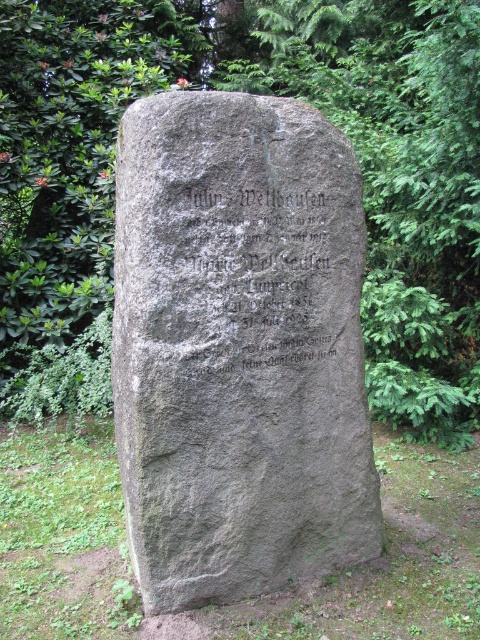
Identify the location of gray stone gravestone at center. (239, 348).

Who is more distant from viewer, (x=204, y=339) or (x=194, y=340)?

The point (x=204, y=339) is behind.

Which is in front, point (157, 387) or point (227, 323)?

Point (157, 387) is in front.

Identify the location of gray stone gravestone at center. (239, 348).

Does point (176, 36) come farther from viewer compared to point (121, 381)?

Yes, it is behind point (121, 381).

In the scene shown: Between green leafy tree at upper center and gray stone gravestone at center, which one appears on the right side from the viewer's perspective?

gray stone gravestone at center

Locate an element on the screen. Image resolution: width=480 pixels, height=640 pixels. green leafy tree at upper center is located at coordinates (252, 92).

Find the location of a particular element. The width and height of the screenshot is (480, 640). green leafy tree at upper center is located at coordinates (252, 92).

Who is more distant from viewer, (444, 216) or (284, 221)?

Point (444, 216)

Identify the location of green leafy tree at upper center. This screenshot has width=480, height=640. (252, 92).